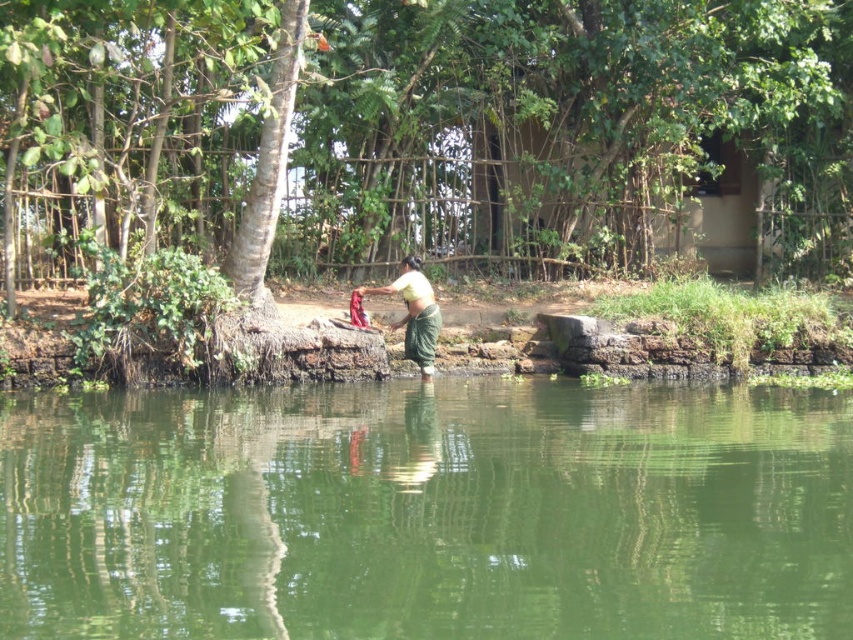
Question: Which object is positioned closest to the green leafy tree at center?

Choices:
 (A) yellow-green fabric at center
 (B) green smooth water at center

Answer: (A)

Question: Can you confirm if green smooth water at center is positioned to the right of yellow-green fabric at center?

Choices:
 (A) yes
 (B) no

Answer: (A)

Question: In this image, where is green smooth water at center located relative to green leafy tree at center?

Choices:
 (A) right
 (B) left

Answer: (B)

Question: Among these objects, which one is nearest to the camera?

Choices:
 (A) green smooth water at center
 (B) green leafy tree at center
 (C) yellow-green fabric at center

Answer: (A)

Question: Which object is farther from the camera taking this photo?

Choices:
 (A) yellow-green fabric at center
 (B) green leafy tree at center

Answer: (A)

Question: Is green smooth water at center wider than yellow-green fabric at center?

Choices:
 (A) yes
 (B) no

Answer: (A)